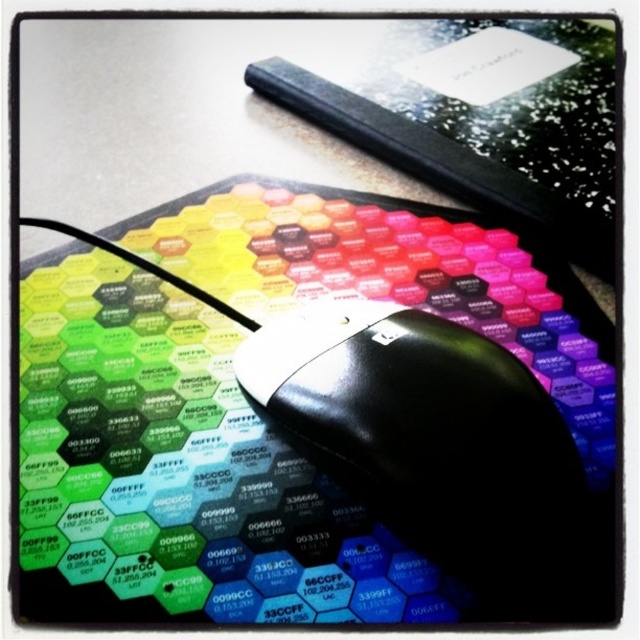
You are organizing your desk and want to place a black plastic mouse at center so it can be easily accessed. However, there is already a hexagonal patterned mousepad at center. Can the mouse be placed in front of the mousepad without overlapping?

The black plastic mouse at center is currently behind the hexagonal patterned mousepad at center, so moving it to the front would require adjusting their positions. Since the mousepad is at the center, there might be limited space, but as long as there is enough room on the desk, the mouse can be placed in front of the mousepad without overlapping by positioning it over the mousepad while ensuring they don

You are organizing your desk and need to place both the hexagonal patterned mousepad at center and the black plastic mouse at center. Given their sizes, which one should you place first to ensure both fit properly?

The hexagonal patterned mousepad at center is bigger than the black plastic mouse at center, so you should place the hexagonal patterned mousepad at center first to ensure there is enough space for both items.

You are trying to locate the hexagonal patterned mousepad at center in the image. The mousepad is marked with a point at coordinates point (179, 474). Can you confirm if this point is within the boundaries of the mousepad?

The point (179, 474) corresponds to the hexagonal patterned mousepad at center, so yes, the point is within the boundaries of the mousepad.